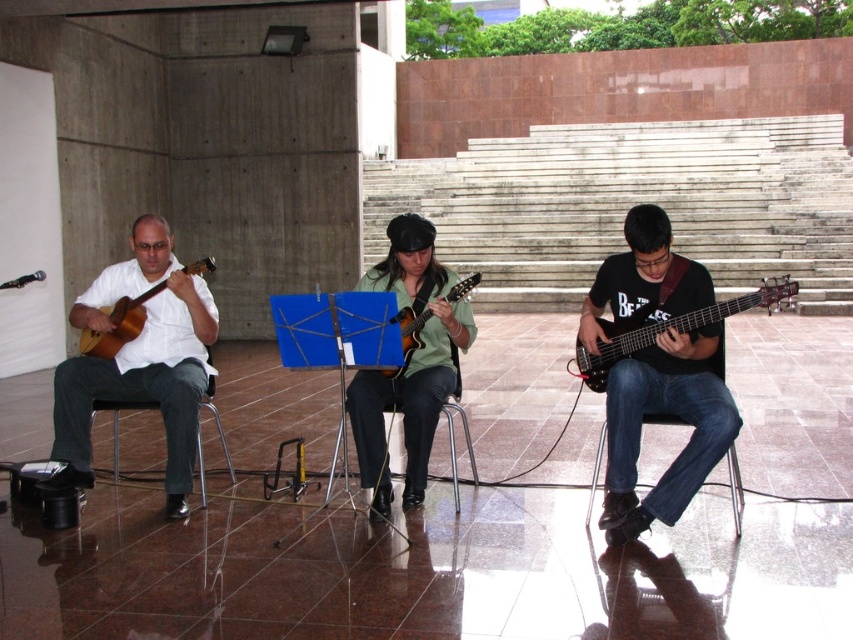
Question: Estimate the real-world distances between objects in this image. Which object is farther from the metallic silver chair at left?

Choices:
 (A) shiny black electric guitar at center right
 (B) black matte guitar at right

Answer: (B)

Question: Does black matte guitar at right appear under metallic silver chair at left?

Choices:
 (A) yes
 (B) no

Answer: (B)

Question: Which point is farther from the camera taking this photo?

Choices:
 (A) (409, 356)
 (B) (123, 337)
 (C) (202, 397)

Answer: (C)

Question: Among these objects, which one is nearest to the camera?

Choices:
 (A) matte white shirt at left
 (B) metallic silver chair at left
 (C) black matte guitar at right
 (D) shiny black electric guitar at center right

Answer: (D)

Question: Does black matte guitar at right come behind matte white shirt at left?

Choices:
 (A) no
 (B) yes

Answer: (A)

Question: Does shiny black electric guitar at center right have a lesser width compared to metallic silver chair at left?

Choices:
 (A) no
 (B) yes

Answer: (A)